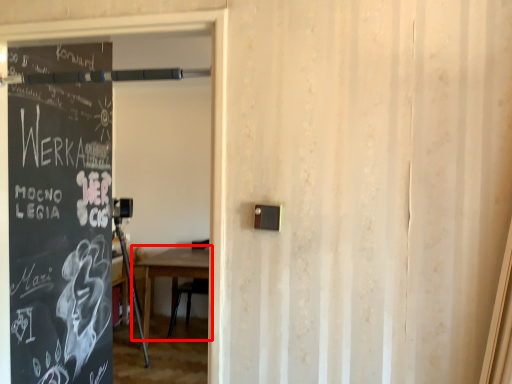
Question: Observing the image, what is the correct spatial positioning of table (annotated by the red box) in reference to garage door?

Choices:
 (A) left
 (B) right

Answer: (A)